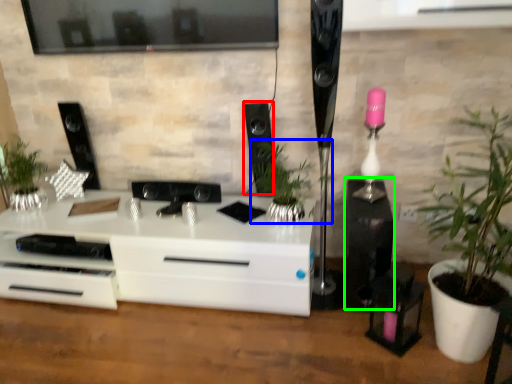
Question: Which object is positioned closest to speaker (highlighted by a red box)? Select from houseplant (highlighted by a blue box) and speaker (highlighted by a green box).

Choices:
 (A) houseplant
 (B) speaker

Answer: (A)